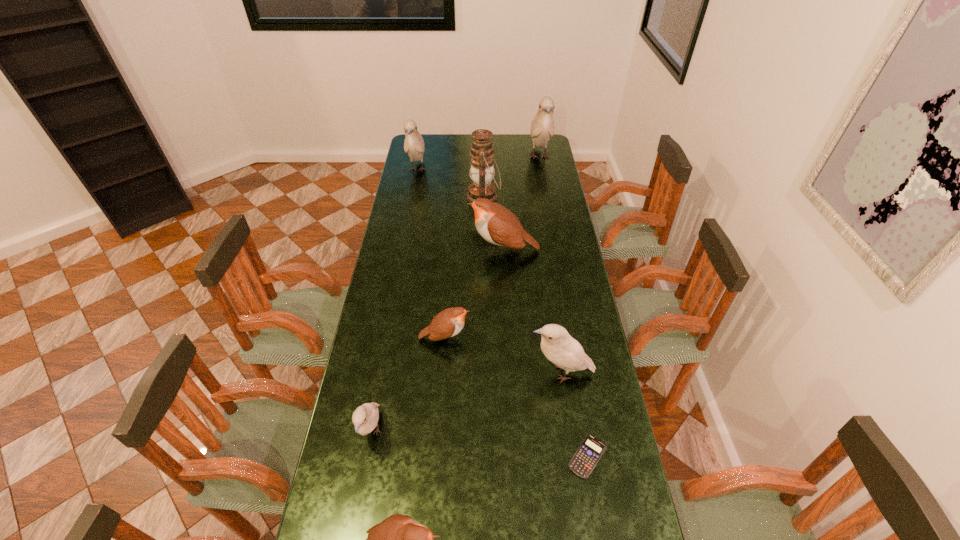
You are a GUI agent. You are given a task and a screenshot of the screen. Output one action in this format:
    pyautogui.click(x=<x>, y=<y>)
    Task: Click on the object that is the sixth nearest to the lantern
    Image resolution: width=960 pixels, height=540 pixels.
    Given the screenshot: What is the action you would take?
    (365, 418)

Locate an element on the screen. This screenshot has width=960, height=540. the fourth closest bird to the lantern is located at coordinates (449, 322).

Identify the location of bird object that ranks as the sixth closest to the lantern. (365, 418).

In order to click on white bird that is the closest to the lantern in this screenshot , I will do `click(542, 127)`.

Locate an element on the screen. The width and height of the screenshot is (960, 540). white bird that is the third closest one to the smallest white bird is located at coordinates (542, 127).

Find the location of a particular element. This screenshot has height=540, width=960. brown bird that stands as the second closest to the third nearest bird is located at coordinates click(495, 223).

Identify which brown bird is the second closest to the nearest brown bird. Please provide its 2D coordinates. Your answer should be formatted as a tuple, i.e. [(x, y)], where the tuple contains the x and y coordinates of a point satisfying the conditions above.

[(495, 223)]

The width and height of the screenshot is (960, 540). I want to click on vacant area that satisfies the following two spatial constraints: 1. at the face of the shortest object; 2. on the left side of the farthest brown bird, so click(516, 456).

Where is `vacant region that satisfies the following two spatial constraints: 1. at the beak of the third nearest bird; 2. at the beak of the sixth farthest bird`? vacant region that satisfies the following two spatial constraints: 1. at the beak of the third nearest bird; 2. at the beak of the sixth farthest bird is located at coordinates (x=569, y=432).

The width and height of the screenshot is (960, 540). I want to click on vacant space that satisfies the following two spatial constraints: 1. at the beak of the sixth farthest object; 2. at the beak of the second nearest bird, so click(x=569, y=432).